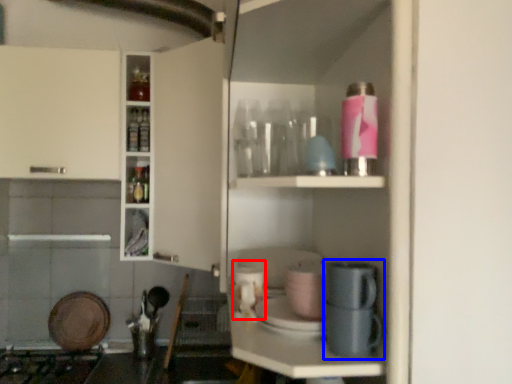
Question: Which object is closer to the camera taking this photo, appliance (highlighted by a red box) or coffee machine (highlighted by a blue box)?

Choices:
 (A) appliance
 (B) coffee machine

Answer: (B)